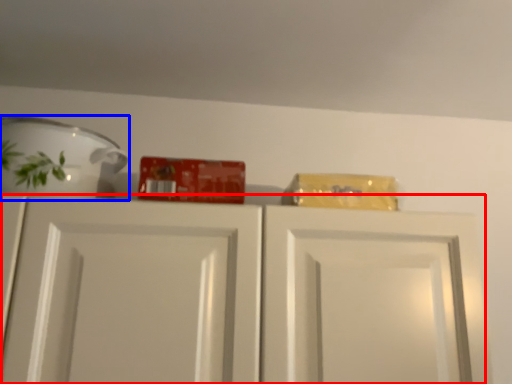
Question: Which object is closer to the camera taking this photo, cabinetry (highlighted by a red box) or tableware (highlighted by a blue box)?

Choices:
 (A) cabinetry
 (B) tableware

Answer: (A)